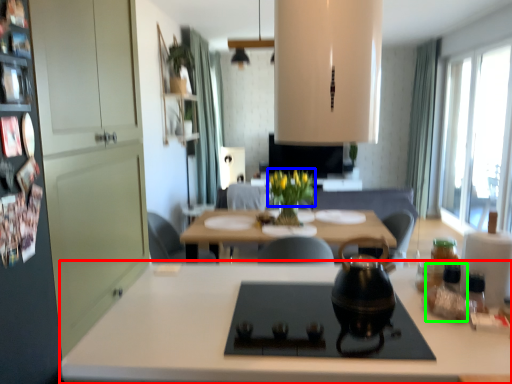
Question: Estimate the real-world distances between objects in this image. Which object is farther from countertop (highlighted by a red box), flower (highlighted by a blue box) or bottle (highlighted by a green box)?

Choices:
 (A) flower
 (B) bottle

Answer: (A)